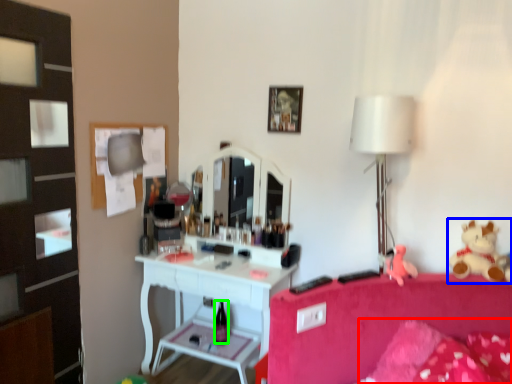
Question: Which object is positioned closest to pillow (highlighted by a red box)? Select from teddy bear (highlighted by a blue box) and bottle (highlighted by a green box).

Choices:
 (A) teddy bear
 (B) bottle

Answer: (A)